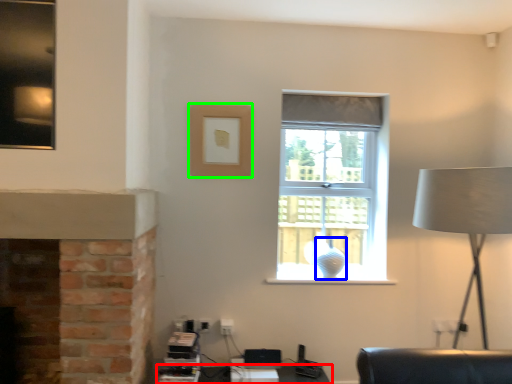
Question: Which is nearer to the table (highlighted by a red box)? glass vase (highlighted by a blue box) or picture frame (highlighted by a green box).

Choices:
 (A) glass vase
 (B) picture frame

Answer: (A)